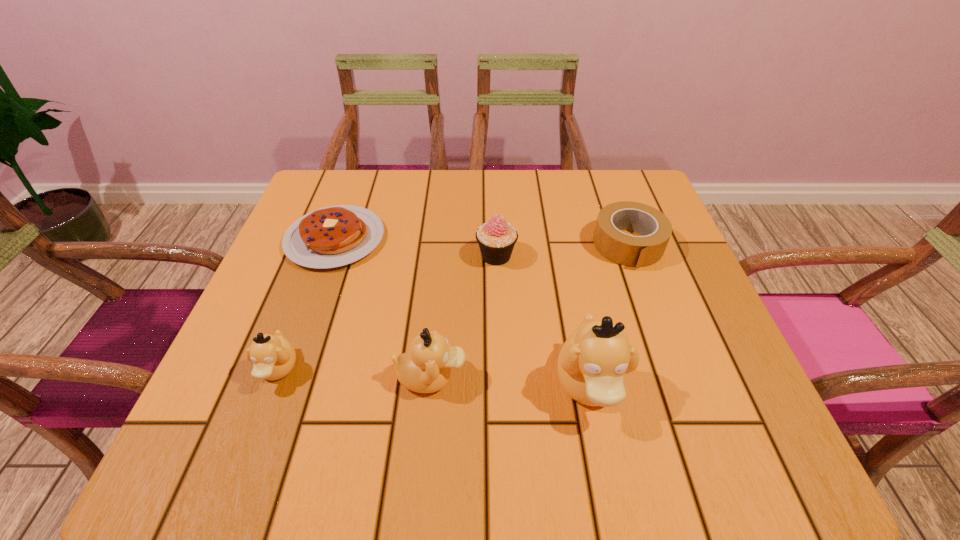
Where is `the fourth tallest object`? the fourth tallest object is located at coordinates (273, 356).

Locate an element on the screen. The image size is (960, 540). the shortest duckling is located at coordinates pos(273,356).

You are a GUI agent. You are given a task and a screenshot of the screen. Output one action in this format:
    pyautogui.click(x=<x>, y=<y>)
    Task: Click on the second tallest duckling
    
    Given the screenshot: What is the action you would take?
    pyautogui.click(x=426, y=368)

The image size is (960, 540). Find the location of `the second duckling from left to right`. the second duckling from left to right is located at coordinates (426, 368).

Where is `the tallest duckling`? This screenshot has width=960, height=540. the tallest duckling is located at coordinates (592, 365).

Identify the location of the fifth object from left to right. click(592, 365).

The width and height of the screenshot is (960, 540). Identify the location of pancake. (333, 236).

Identify the location of the fifth tallest object. (634, 251).

In order to click on duct tape in this screenshot , I will do `click(634, 251)`.

Where is `the third object from right to left`? The width and height of the screenshot is (960, 540). the third object from right to left is located at coordinates (496, 238).